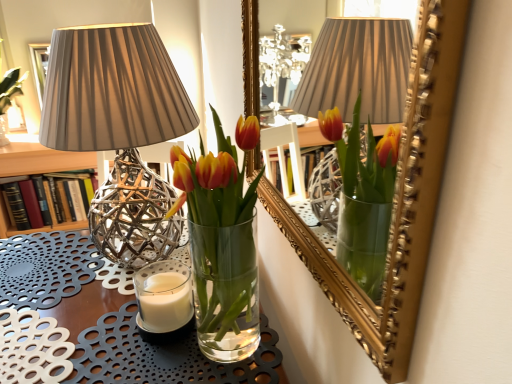
The width and height of the screenshot is (512, 384). I want to click on vacant space behind white wax candle at lower left, so click(x=145, y=265).